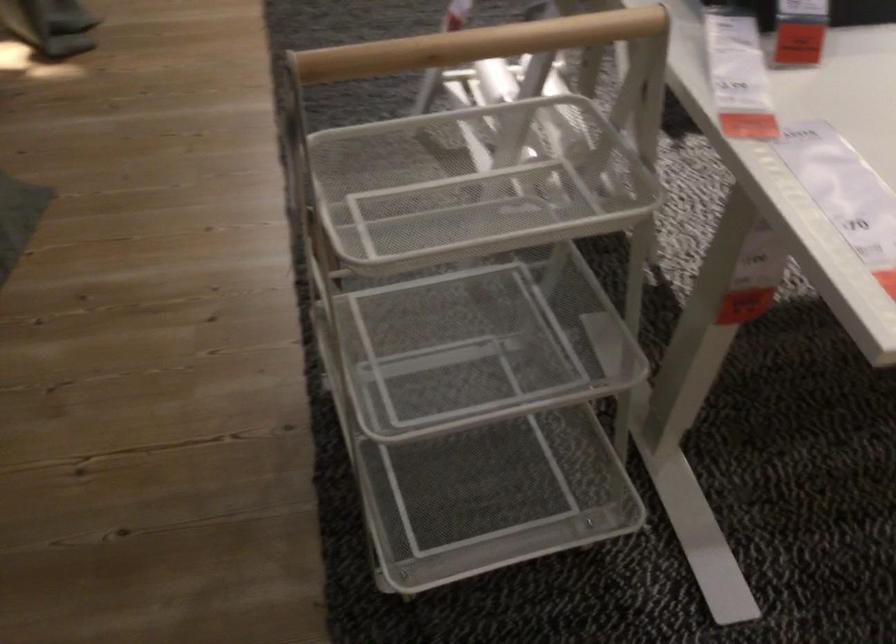
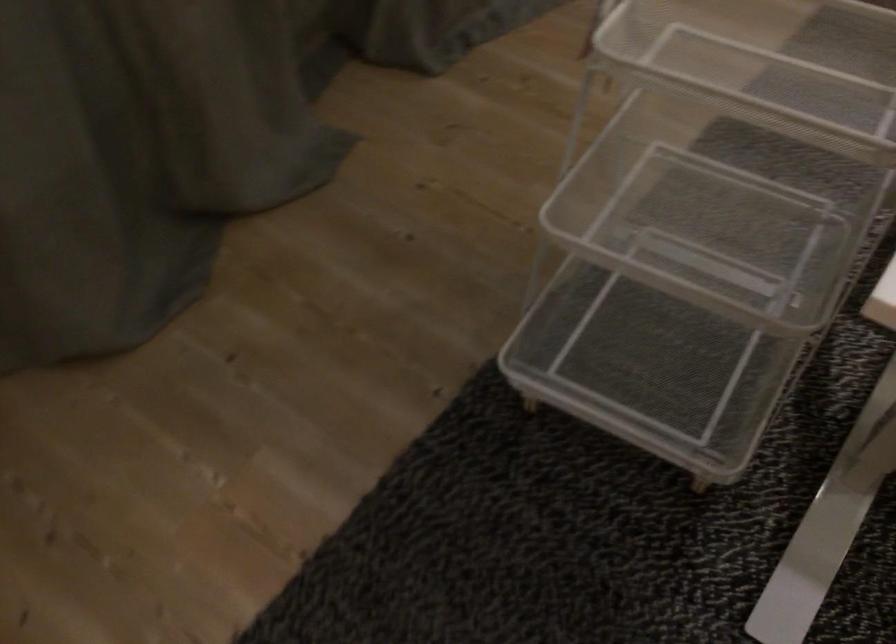
Find the pixel in the second image that matches the point at 483,183 in the first image.

(806, 69)